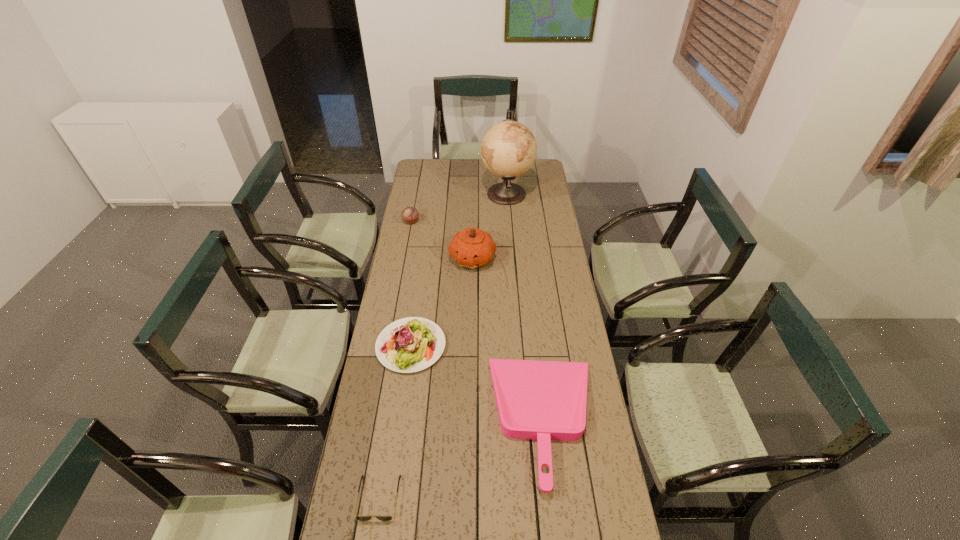
Where is `globe`? Image resolution: width=960 pixels, height=540 pixels. globe is located at coordinates (508, 149).

Locate an element on the screen. Image resolution: width=960 pixels, height=540 pixels. the tallest object is located at coordinates (508, 149).

This screenshot has width=960, height=540. In order to click on the fifth shortest object in this screenshot , I will do `click(472, 247)`.

You are a GUI agent. You are given a task and a screenshot of the screen. Output one action in this format:
    pyautogui.click(x=<x>, y=<y>)
    Task: Click on the pumpkin
    
    Given the screenshot: What is the action you would take?
    pyautogui.click(x=472, y=247)

The height and width of the screenshot is (540, 960). Identify the location of muffin. (410, 214).

Image resolution: width=960 pixels, height=540 pixels. In order to click on the fourth shortest object in this screenshot , I will do `click(410, 214)`.

I want to click on salad plate, so click(411, 344).

You are a GUI agent. You are given a task and a screenshot of the screen. Output one action in this format:
    pyautogui.click(x=<x>, y=<y>)
    Task: Click on the dustpan
    The image size is (960, 540).
    Given the screenshot: What is the action you would take?
    pyautogui.click(x=542, y=400)

Find the location of `sunglasses`. sunglasses is located at coordinates (361, 518).

This screenshot has width=960, height=540. I want to click on free space located on the front-facing side of the globe, so click(x=435, y=193).